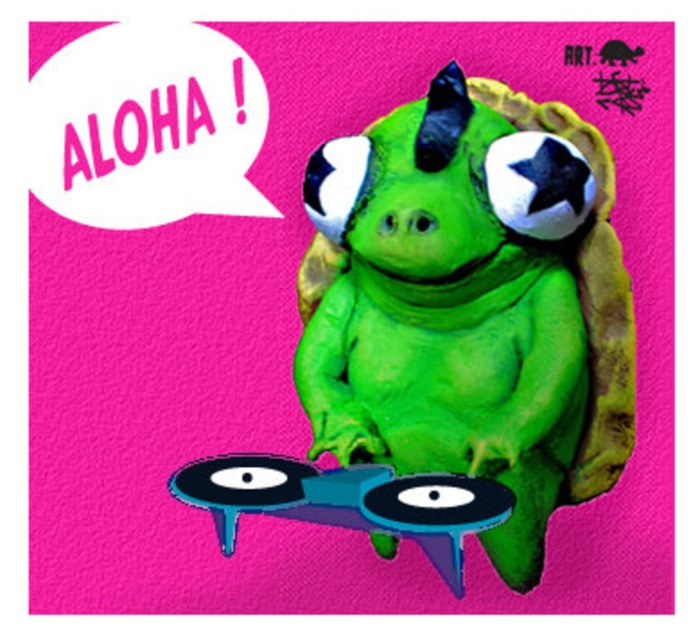
Question: Does green rubber turtle at center appear under blue rubber record at center?

Choices:
 (A) yes
 (B) no

Answer: (B)

Question: Is green rubber turtle at center smaller than blue rubber record at center?

Choices:
 (A) yes
 (B) no

Answer: (B)

Question: Which object is closer to the camera taking this photo?

Choices:
 (A) blue rubber record at center
 (B) green rubber turtle at center

Answer: (A)

Question: Is green rubber turtle at center bigger than blue rubber record at center?

Choices:
 (A) yes
 (B) no

Answer: (A)